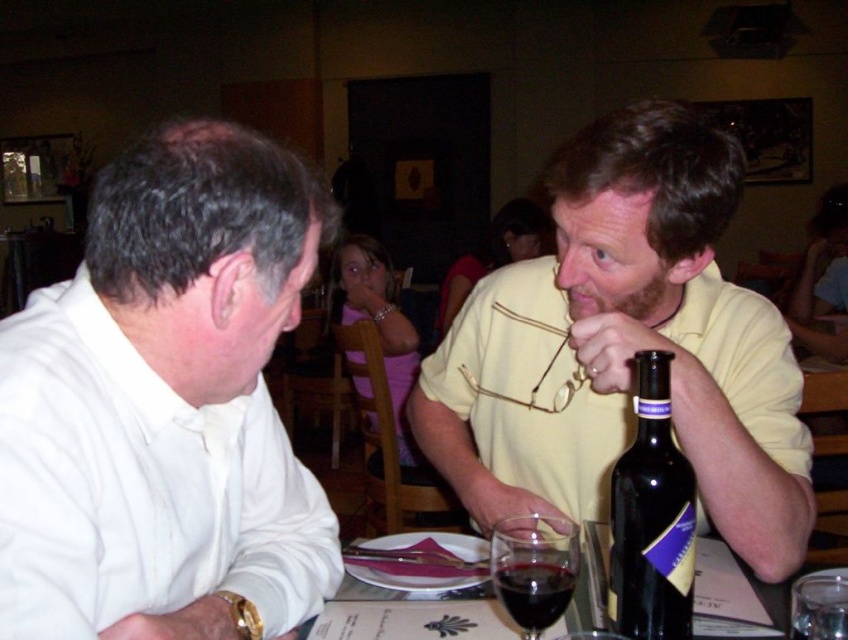
Based on the scene description, where is the translucent glass wine at center located in the image?

The translucent glass wine at center is located at point coordinates of (729, 596) in the image.

You are standing in the restaurant and want to place a small vase between the two points labeled point (x=434, y=465) and point (x=344, y=620). Which point should the vase be closer to if it needs to be placed closer to the viewer?

The vase should be placed closer to point (x=434, y=465) because it is further to the camera than point (x=344, y=620).